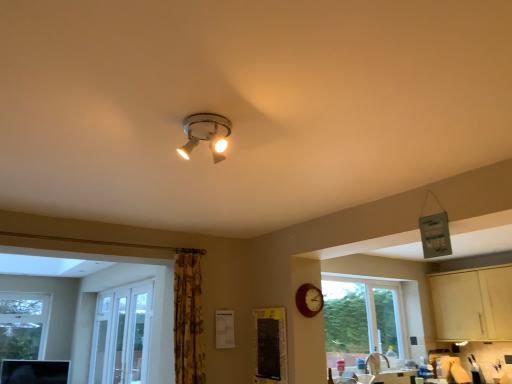
The width and height of the screenshot is (512, 384). Describe the element at coordinates (188, 317) in the screenshot. I see `yellow floral fabric curtain at center-left` at that location.

I want to click on yellow floral fabric curtain at center-left, so (188, 317).

Where is `wooden clock at lower right`? wooden clock at lower right is located at coordinates (309, 300).

From their relative heights in the image, would you say wooden clock at lower right is taller or shorter than black fabric bulletin board at lower center?

In the image, wooden clock at lower right appears to be shorter than black fabric bulletin board at lower center.

How many degrees apart are the facing directions of wooden clock at lower right and black fabric bulletin board at lower center?

89.1 degrees.

I want to click on clock that appears above the black fabric bulletin board at lower center (from a real-world perspective), so click(x=309, y=300).

Is point (306, 308) in front of point (281, 344)?

No, it is behind (281, 344).

Would you say matte silver spotlight at upper center is part of yellow floral fabric curtain at center-left's contents?

No, matte silver spotlight at upper center is not a part of yellow floral fabric curtain at center-left.

Does yellow floral fabric curtain at center-left have a lesser width compared to matte silver spotlight at upper center?

Yes.

How many degrees apart are the facing directions of yellow floral fabric curtain at center-left and matte silver spotlight at upper center?

There is a 92-degree angle between the facing directions of yellow floral fabric curtain at center-left and matte silver spotlight at upper center.

From the image's perspective, is yellow floral fabric curtain at center-left on top of matte silver spotlight at upper center?

Actually, yellow floral fabric curtain at center-left appears below matte silver spotlight at upper center in the image.

Based on the photo, from a real-world perspective, is black fabric bulletin board at lower center under light wood cabinet at lower right?

Yes.

Consider the image. Is black fabric bulletin board at lower center closer to camera compared to light wood cabinet at lower right?

Yes, black fabric bulletin board at lower center is in front of light wood cabinet at lower right.

Based on the photo, how distant is black fabric bulletin board at lower center from light wood cabinet at lower right?

black fabric bulletin board at lower center is 11.65 feet from light wood cabinet at lower right.

Is black fabric bulletin board at lower center positioned with its back to light wood cabinet at lower right?

Yes, light wood cabinet at lower right is at the back of black fabric bulletin board at lower center.

From the picture: From the image's perspective, is matte silver spotlight at upper center above or below black fabric bulletin board at lower center?

From the image's perspective, matte silver spotlight at upper center appears above black fabric bulletin board at lower center.

Would you say black fabric bulletin board at lower center is part of matte silver spotlight at upper center's contents?

No, black fabric bulletin board at lower center is not inside matte silver spotlight at upper center.

Could you tell me if matte silver spotlight at upper center is turned towards black fabric bulletin board at lower center?

No.

How different are the orientations of matte silver spotlight at upper center and black fabric bulletin board at lower center in degrees?

The angular difference between matte silver spotlight at upper center and black fabric bulletin board at lower center is 178 degrees.

From a real-world perspective, does yellow floral fabric curtain at center-left sit lower than black fabric bulletin board at lower center?

No.

Can you confirm if yellow floral fabric curtain at center-left is taller than black fabric bulletin board at lower center?

Correct, yellow floral fabric curtain at center-left is much taller as black fabric bulletin board at lower center.

Is there a large distance between yellow floral fabric curtain at center-left and black fabric bulletin board at lower center?

That's not correct — yellow floral fabric curtain at center-left is a little close to black fabric bulletin board at lower center.

Which is less distant, (203, 344) or (272, 368)?

Point (203, 344) is positioned farther from the camera compared to point (272, 368).

Which is more to the right, yellow floral fabric curtain at center-left or wooden clock at lower right?

Positioned to the right is wooden clock at lower right.

From a real-world perspective, is yellow floral fabric curtain at center-left located higher than wooden clock at lower right?

No, from a real-world perspective, yellow floral fabric curtain at center-left is not above wooden clock at lower right.

Is yellow floral fabric curtain at center-left thinner than wooden clock at lower right?

No, yellow floral fabric curtain at center-left is not thinner than wooden clock at lower right.

Is yellow floral fabric curtain at center-left looking in the opposite direction of wooden clock at lower right?

yellow floral fabric curtain at center-left does not have its back to wooden clock at lower right.

Consider the image. Considering the positions of objects black fabric bulletin board at lower center and yellow floral fabric curtain at center-left in the image provided, who is behind, black fabric bulletin board at lower center or yellow floral fabric curtain at center-left?

black fabric bulletin board at lower center is behind.

From the picture: Is black fabric bulletin board at lower center wider than yellow floral fabric curtain at center-left?

Incorrect, the width of black fabric bulletin board at lower center does not surpass that of yellow floral fabric curtain at center-left.

Is black fabric bulletin board at lower center aimed at yellow floral fabric curtain at center-left?

Yes, black fabric bulletin board at lower center is turned towards yellow floral fabric curtain at center-left.

From the picture: From the image's perspective, is black fabric bulletin board at lower center located above yellow floral fabric curtain at center-left?

No.

Where is `clock above the black fabric bulletin board at lower center (from the image's perspective)`? The height and width of the screenshot is (384, 512). clock above the black fabric bulletin board at lower center (from the image's perspective) is located at coordinates (309, 300).

I want to click on curtain on the left of matte silver spotlight at upper center, so click(x=188, y=317).

Looking at the image, which one is located closer to black fabric bulletin board at lower center, light wood cabinet at lower right or wooden clock at lower right?

Among the two, wooden clock at lower right is located nearer to black fabric bulletin board at lower center.

Considering their positions, is black fabric bulletin board at lower center positioned closer to light wood cabinet at lower right than matte silver spotlight at upper center?

black fabric bulletin board at lower center.

Estimate the real-world distances between objects in this image. Which object is further from yellow floral fabric curtain at center-left, black fabric bulletin board at lower center or wooden clock at lower right?

wooden clock at lower right lies further to yellow floral fabric curtain at center-left than the other object.

Based on their spatial positions, is yellow floral fabric curtain at center-left or light wood cabinet at lower right further from black fabric bulletin board at lower center?

The object further to black fabric bulletin board at lower center is light wood cabinet at lower right.

From the image, which object appears to be farther from matte silver spotlight at upper center, black fabric bulletin board at lower center or yellow floral fabric curtain at center-left?

Among the two, black fabric bulletin board at lower center is located further to matte silver spotlight at upper center.

From the image, which object appears to be nearer to yellow floral fabric curtain at center-left, black fabric bulletin board at lower center or matte silver spotlight at upper center?

black fabric bulletin board at lower center.

Looking at the image, which one is located further to black fabric bulletin board at lower center, matte silver spotlight at upper center or yellow floral fabric curtain at center-left?

Based on the image, matte silver spotlight at upper center appears to be further to black fabric bulletin board at lower center.

Based on their spatial positions, is black fabric bulletin board at lower center or light wood cabinet at lower right closer to matte silver spotlight at upper center?

Among the two, black fabric bulletin board at lower center is located nearer to matte silver spotlight at upper center.

This screenshot has width=512, height=384. I want to click on bulletin board positioned between matte silver spotlight at upper center and wooden clock at lower right from near to far, so click(270, 346).

Identify the location of curtain positioned between matte silver spotlight at upper center and black fabric bulletin board at lower center from near to far. (188, 317).

Image resolution: width=512 pixels, height=384 pixels. Find the location of `clock situated between yellow floral fabric curtain at center-left and light wood cabinet at lower right from left to right`. clock situated between yellow floral fabric curtain at center-left and light wood cabinet at lower right from left to right is located at coordinates (309, 300).

Locate an element on the screen. The image size is (512, 384). clock between matte silver spotlight at upper center and light wood cabinet at lower right is located at coordinates (309, 300).